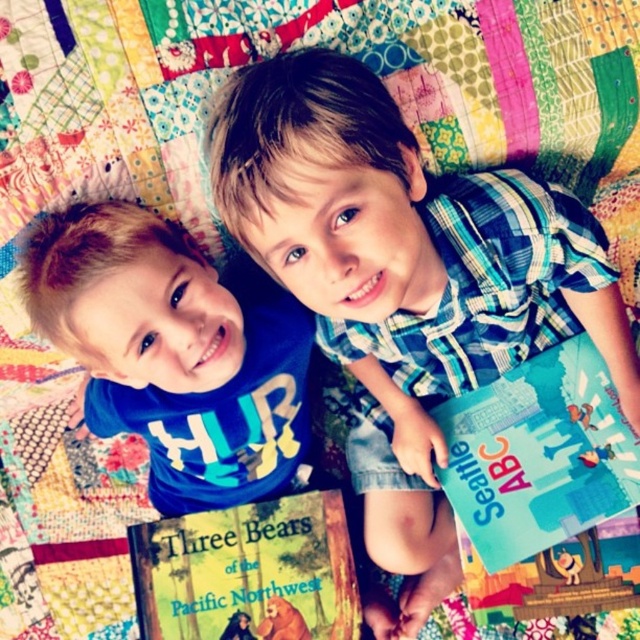
Does blue cotton shirt at left lie in front of hardcover book at center?

Yes, blue cotton shirt at left is in front of hardcover book at center.

Does blue cotton shirt at left appear under hardcover book at center?

Incorrect, blue cotton shirt at left is not positioned below hardcover book at center.

Identify the location of blue cotton shirt at left. This screenshot has height=640, width=640. (176, 353).

Locate an element on the screen. blue cotton shirt at left is located at coordinates (176, 353).

Is teal glossy book at right thinner than hardcover book at center?

Yes.

Between teal glossy book at right and hardcover book at center, which one has less height?

hardcover book at center

Is point (595, 410) in front of point (269, 582)?

Yes, it is.

You are a GUI agent. You are given a task and a screenshot of the screen. Output one action in this format:
    pyautogui.click(x=<x>, y=<y>)
    Task: Click on the teal glossy book at right
    
    Given the screenshot: What is the action you would take?
    pyautogui.click(x=538, y=454)

How distant is blue cotton shirt at left from teal glossy book at right?

They are 15.89 inches apart.

Who is taller, blue cotton shirt at left or teal glossy book at right?

Standing taller between the two is blue cotton shirt at left.

This screenshot has width=640, height=640. Find the location of `blue cotton shirt at left`. blue cotton shirt at left is located at coordinates (176, 353).